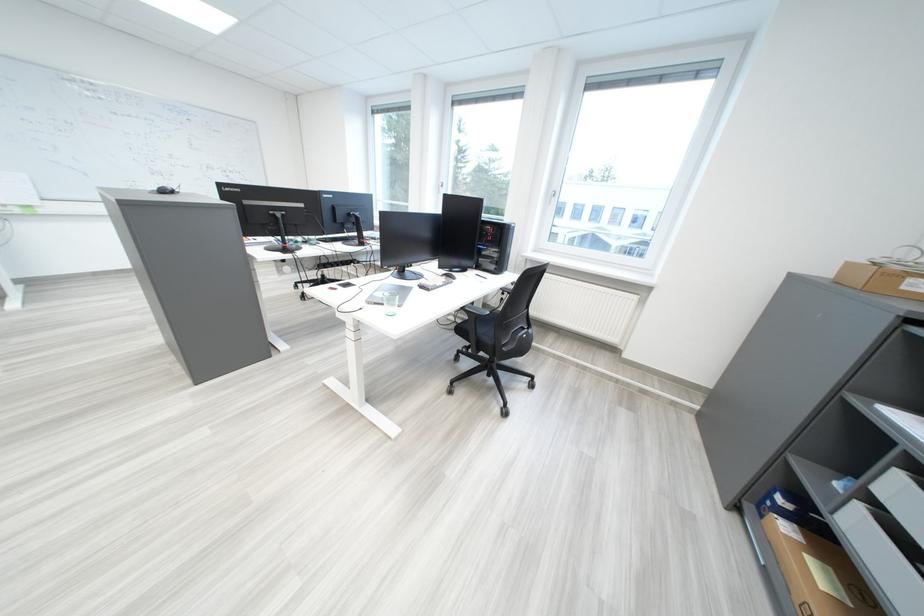
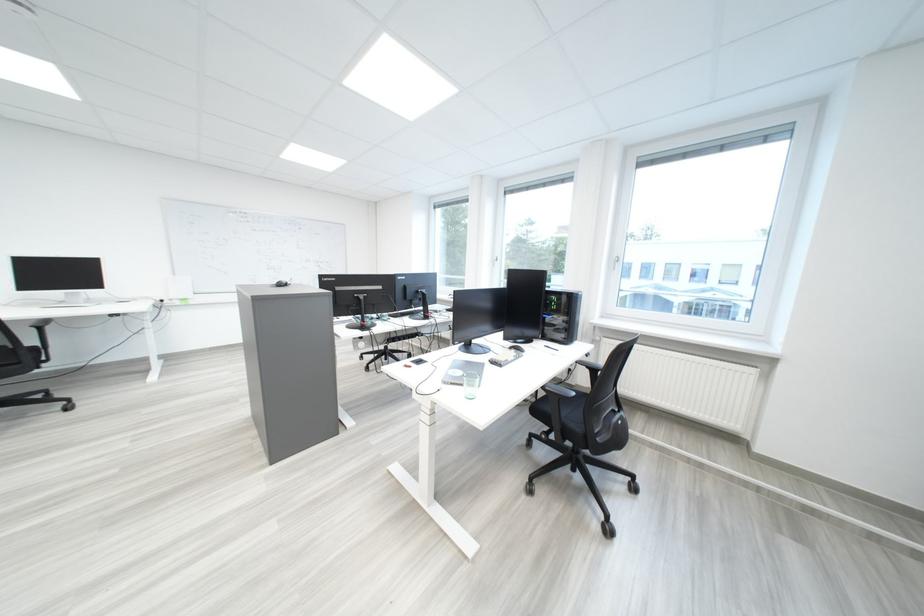
Find the pixel in the second image that matches [149,185] in the first image.

(275, 283)